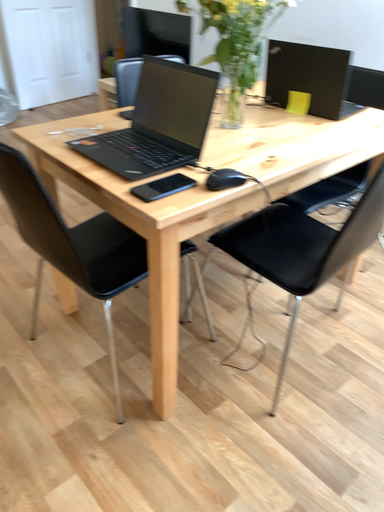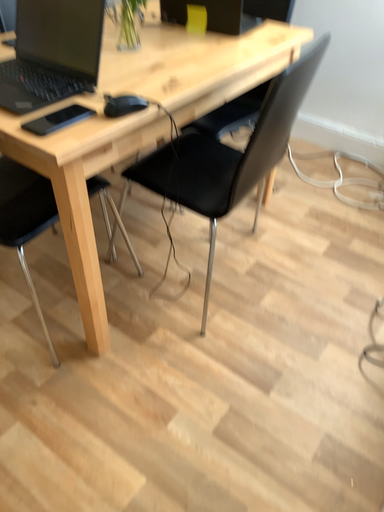
Question: Which way did the camera rotate in the video?

Choices:
 (A) rotated left
 (B) rotated right

Answer: (B)